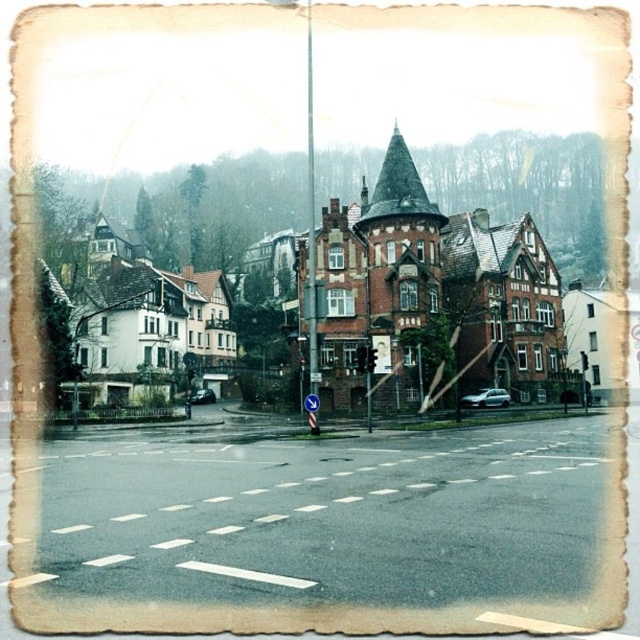
You are standing at the edge of the intersection and want to walk towards the red brick building at center. Which direction should you walk to avoid stepping on the white asphalt at center?

You should walk towards the red brick building at center while avoiding the white asphalt at center by moving to the side, as the red brick building at center is closer to you than the white asphalt at center, meaning the asphalt is behind it.

You are a delivery driver approaching the intersection and need to turn right. You see the red brick building at center and the white asphalt at center. Which object should you use as a reference point to ensure you are in the correct right turn lane indicated by the blue sign?

The red brick building at center is positioned on the right side of white asphalt at center, so you should align your vehicle with the red brick building at center to stay in the correct right turn lane.